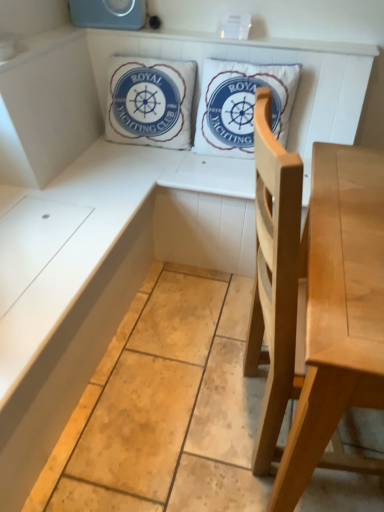
Question: Considering the relative sizes of white cotton cushion at upper center, the 2th pillow when ordered from right to left, and light wood chair at center in the image provided, is white cotton cushion at upper center, the 2th pillow when ordered from right to left, thinner than light wood chair at center?

Choices:
 (A) no
 (B) yes

Answer: (B)

Question: Could you tell me if white cotton cushion at upper center, the 2th pillow when ordered from right to left, is facing light wood chair at center?

Choices:
 (A) yes
 (B) no

Answer: (B)

Question: Is there a large distance between white cotton cushion at upper center, the 1th pillow from the left, and light wood chair at center?

Choices:
 (A) no
 (B) yes

Answer: (B)

Question: Is white cotton cushion at upper center, the 1th pillow from the left, outside light wood chair at center?

Choices:
 (A) yes
 (B) no

Answer: (A)

Question: Can you confirm if white cotton cushion at upper center, the 2th pillow when ordered from right to left, is positioned to the left of light wood chair at center?

Choices:
 (A) yes
 (B) no

Answer: (A)

Question: Does white cotton cushion at upper center, the 1th pillow from the left, lie behind light wood chair at center?

Choices:
 (A) no
 (B) yes

Answer: (B)

Question: From the image's perspective, would you say white cotton pillow at upper center, which appears as the second pillow when viewed from the left, is positioned over light wood chair at center?

Choices:
 (A) yes
 (B) no

Answer: (A)

Question: Is white cotton pillow at upper center, which appears as the second pillow when viewed from the left, positioned beyond the bounds of light wood chair at center?

Choices:
 (A) yes
 (B) no

Answer: (A)

Question: From a real-world perspective, is white cotton pillow at upper center, which appears as the second pillow when viewed from the left, beneath light wood chair at center?

Choices:
 (A) no
 (B) yes

Answer: (A)

Question: Is white cotton pillow at upper center, which appears as the second pillow when viewed from the left, to the right of light wood chair at center from the viewer's perspective?

Choices:
 (A) yes
 (B) no

Answer: (B)

Question: Can you confirm if white cotton pillow at upper center, which appears as the second pillow when viewed from the left, is wider than light wood chair at center?

Choices:
 (A) yes
 (B) no

Answer: (B)

Question: From a real-world perspective, does white cotton pillow at upper center, which appears as the second pillow when viewed from the left, stand above light wood chair at center?

Choices:
 (A) yes
 (B) no

Answer: (A)

Question: Is light wood chair at center not inside white cotton pillow at upper center, which is the first pillow in right-to-left order?

Choices:
 (A) no
 (B) yes

Answer: (B)